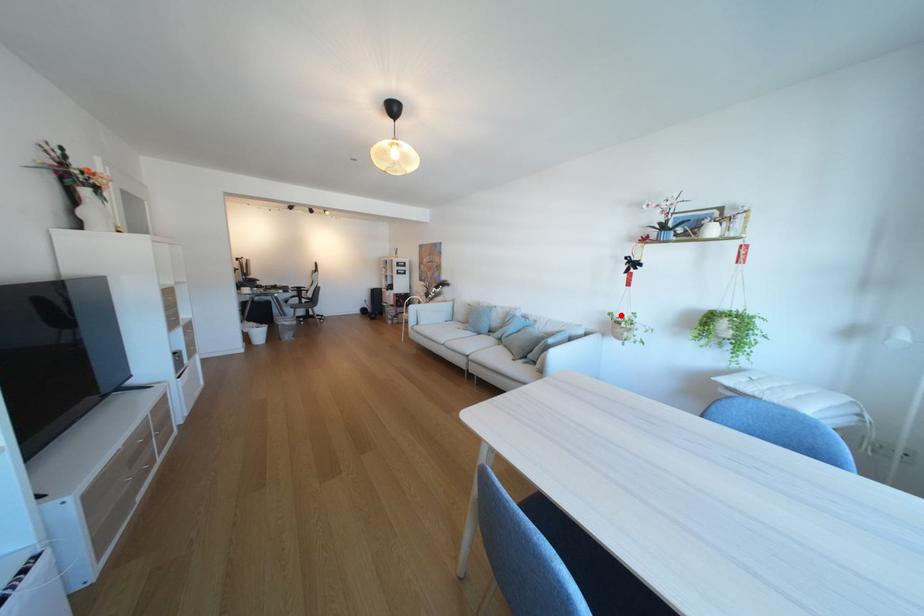
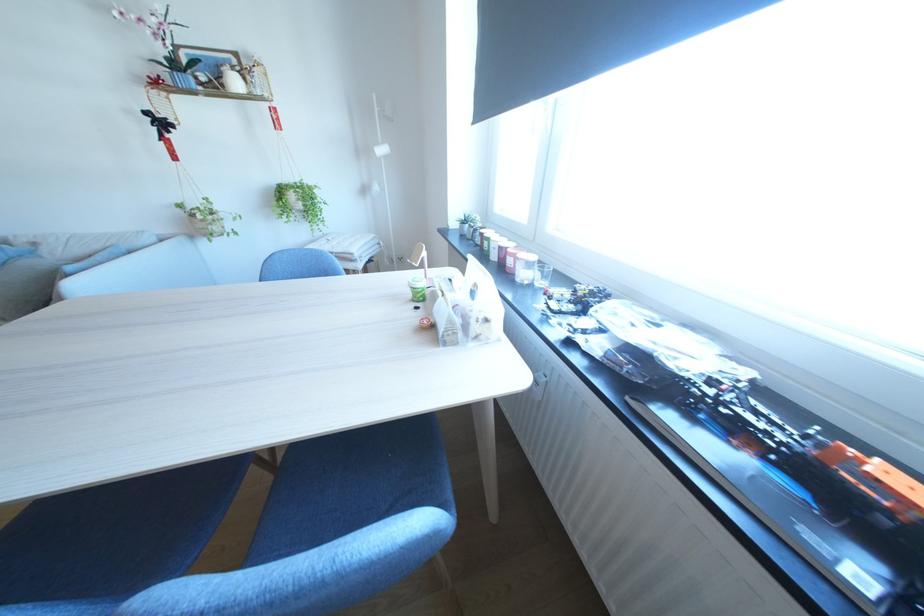
Question: I am providing you with two images of the same scene from different viewpoints. Image1 has a red point marked. In image2, the corresponding 3D location appears at what relative position? Reply with the corresponding letter.

Choices:
 (A) Closer
 (B) Farther

Answer: (B)